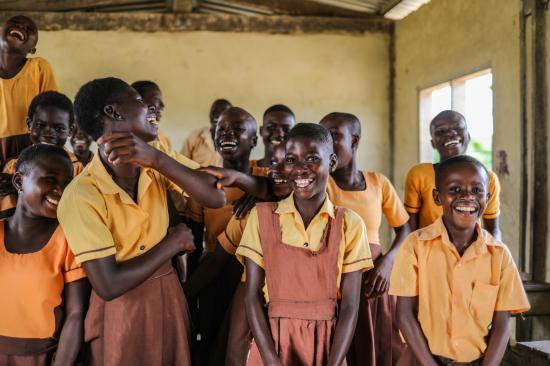
This screenshot has height=366, width=550. I want to click on wall, so click(230, 74), click(427, 38).